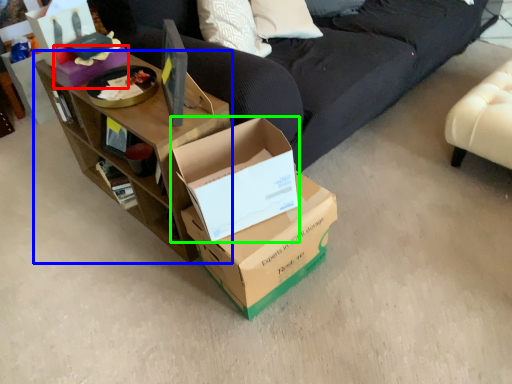
Question: Considering the real-world distances, which object is farthest from box (highlighted by a red box)? shelf (highlighted by a blue box) or box (highlighted by a green box)?

Choices:
 (A) shelf
 (B) box

Answer: (B)